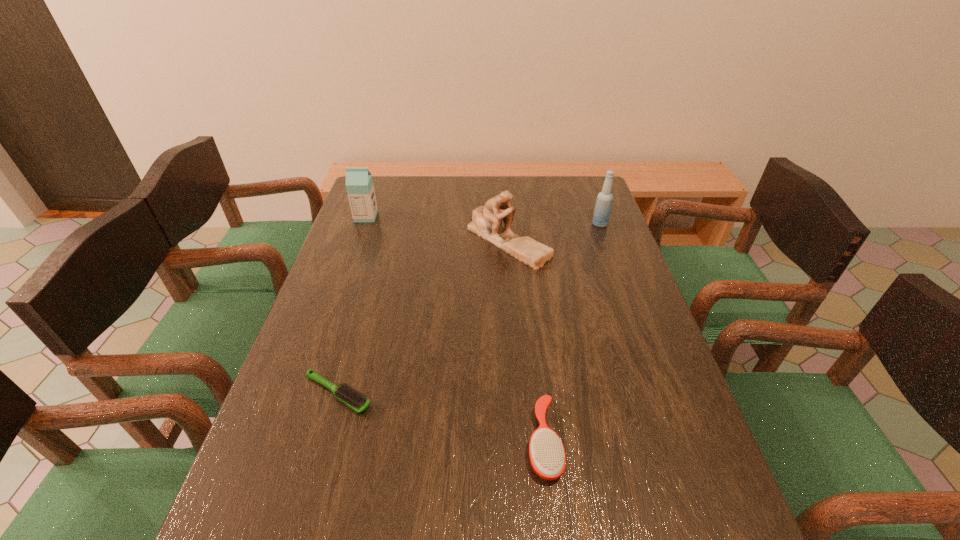
The width and height of the screenshot is (960, 540). Find the location of `the rightmost object`. the rightmost object is located at coordinates (603, 205).

You are a GUI agent. You are given a task and a screenshot of the screen. Output one action in this format:
    pyautogui.click(x=<x>, y=<y>)
    Task: Click on the milk carton
    
    Given the screenshot: What is the action you would take?
    pyautogui.click(x=359, y=184)

The image size is (960, 540). Identify the location of figurine. (486, 223).

Image resolution: width=960 pixels, height=540 pixels. In order to click on the fourth tallest object in this screenshot , I will do `click(547, 454)`.

Identify the location of the taller hairbrush. The image size is (960, 540). (547, 454).

Locate an element on the screen. This screenshot has width=960, height=540. the left hairbrush is located at coordinates (346, 394).

You are a GUI agent. You are given a task and a screenshot of the screen. Output one action in this format:
    pyautogui.click(x=<x>, y=<y>)
    Task: Click on the shortest object
    Image resolution: width=960 pixels, height=540 pixels.
    Given the screenshot: What is the action you would take?
    pyautogui.click(x=346, y=394)

Locate an element on the screen. The height and width of the screenshot is (540, 960). free space located 0.190m on the front of the rightmost object is located at coordinates (614, 265).

Locate an element on the screen. The width and height of the screenshot is (960, 540). free spot located on the front of the milk carton is located at coordinates (337, 300).

Locate an element on the screen. The width and height of the screenshot is (960, 540). blank space located on the front-facing side of the figurine is located at coordinates (517, 365).